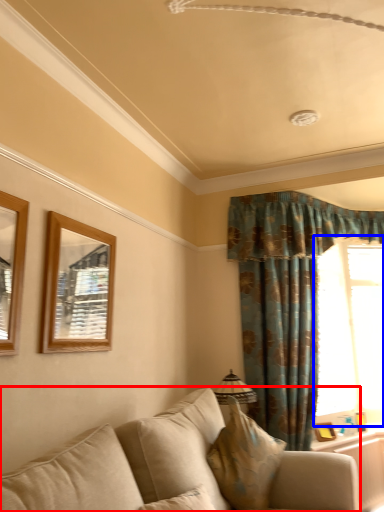
Question: Which point is further to the camera, studio couch (highlighted by a red box) or window (highlighted by a blue box)?

Choices:
 (A) studio couch
 (B) window

Answer: (B)